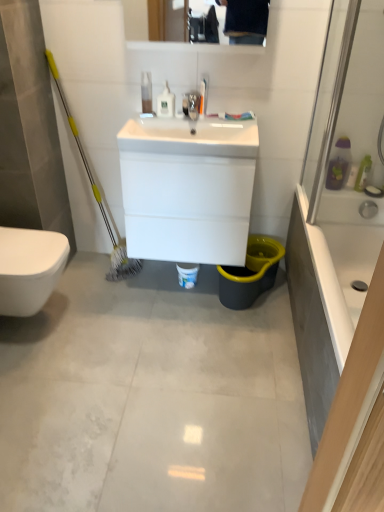
Based on the photo, measure the distance between point (x=164, y=89) and camera.

Point (x=164, y=89) is 2.01 meters from camera.

The height and width of the screenshot is (512, 384). What do you see at coordinates (191, 137) in the screenshot?
I see `white glossy sink at center, the 2th sink in the bottom-to-top sequence` at bounding box center [191, 137].

Locate an element on the screen. white glossy sink at center, which is the first sink from top to bottom is located at coordinates (191, 137).

Describe the element at coordinates (151, 397) in the screenshot. The height and width of the screenshot is (512, 384). I see `gray tile floor at center` at that location.

Find the location of `white glossy bidet at lower left`. white glossy bidet at lower left is located at coordinates (29, 268).

Image resolution: width=384 pixels, height=512 pixels. Describe the element at coordinates (363, 174) in the screenshot. I see `translucent plastic toothbrush at upper right, which is the 3th toiletry in top-to-bottom order` at that location.

The width and height of the screenshot is (384, 512). In order to click on white glossy sink at center, which is the first sink in bottom-to-top order in this screenshot , I will do `click(188, 189)`.

Is white glossy sink at center, which is the first sink in bottom-to-top order, situated inside translucent plastic bottle at upper center, positioned as the third toiletry in bottom-to-top order, or outside?

white glossy sink at center, which is the first sink in bottom-to-top order, is not enclosed by translucent plastic bottle at upper center, positioned as the third toiletry in bottom-to-top order.

Which sink is the 1st one when counting from the right side of the translucent plastic bottle at upper center, the 1th toiletry viewed from the top? Please provide its 2D coordinates.

[(188, 189)]

From the image's perspective, is white glossy sink at center, the 2th sink from the top, over translucent plastic bottle at upper center, which appears as the 1th toiletry when viewed from the left?

No.

From a real-world perspective, is white glossy sink at center, which is the first sink in bottom-to-top order, positioned under translucent plastic bottle at upper center, positioned as the third toiletry in bottom-to-top order, based on gravity?

Yes, from a real-world perspective, white glossy sink at center, which is the first sink in bottom-to-top order, is beneath translucent plastic bottle at upper center, positioned as the third toiletry in bottom-to-top order.

Considering the sizes of objects white glossy bidet at lower left and white glossy bottle at upper center, which is the 2th toiletry from top to bottom, in the image provided, who is wider, white glossy bidet at lower left or white glossy bottle at upper center, which is the 2th toiletry from top to bottom,?

Wider between the two is white glossy bidet at lower left.

Considering the relative sizes of white glossy bidet at lower left and white glossy bottle at upper center, the second toiletry positioned from the right, in the image provided, is white glossy bidet at lower left shorter than white glossy bottle at upper center, the second toiletry positioned from the right,?

Incorrect, the height of white glossy bidet at lower left does not fall short of that of white glossy bottle at upper center, the second toiletry positioned from the right.

This screenshot has width=384, height=512. Identify the location of bidet below the white glossy bottle at upper center, marked as the second toiletry in a bottom-to-top arrangement (from the image's perspective). (29, 268).

Is translucent plastic bottle at upper center, the 1th toiletry viewed from the top, smaller than translucent plastic toothbrush at upper right, which is the 3th toiletry in top-to-bottom order?

Yes, translucent plastic bottle at upper center, the 1th toiletry viewed from the top, is smaller than translucent plastic toothbrush at upper right, which is the 3th toiletry in top-to-bottom order.

Is translucent plastic bottle at upper center, the 1th toiletry viewed from the top, situated inside translucent plastic toothbrush at upper right, positioned as the third toiletry in left-to-right order, or outside?

translucent plastic bottle at upper center, the 1th toiletry viewed from the top, is spatially situated outside translucent plastic toothbrush at upper right, positioned as the third toiletry in left-to-right order.

Considering the relative sizes of translucent plastic bottle at upper center, the 3th toiletry positioned from the right, and translucent plastic toothbrush at upper right, the first toiletry when ordered from right to left, in the image provided, is translucent plastic bottle at upper center, the 3th toiletry positioned from the right, taller than translucent plastic toothbrush at upper right, the first toiletry when ordered from right to left,?

No.

Based on the photo, is white glossy bathtub at right in front of translucent plastic bottle at upper center, positioned as the third toiletry in bottom-to-top order?

Yes, white glossy bathtub at right is in front of translucent plastic bottle at upper center, positioned as the third toiletry in bottom-to-top order.

Is white glossy bathtub at right aimed at translucent plastic bottle at upper center, the 3th toiletry positioned from the right?

No, white glossy bathtub at right is not facing towards translucent plastic bottle at upper center, the 3th toiletry positioned from the right.

Does white glossy bathtub at right have a larger size compared to translucent plastic bottle at upper center, the 1th toiletry viewed from the top?

Yes, white glossy bathtub at right is bigger than translucent plastic bottle at upper center, the 1th toiletry viewed from the top.

Does white glossy bathtub at right have a lesser width compared to translucent plastic bottle at upper center, positioned as the third toiletry in bottom-to-top order?

In fact, white glossy bathtub at right might be wider than translucent plastic bottle at upper center, positioned as the third toiletry in bottom-to-top order.

Could you measure the distance between translucent plastic toothbrush at upper right, the first toiletry when ordered from right to left, and white glossy sink at center, which is the first sink in bottom-to-top order?

A distance of 33.69 inches exists between translucent plastic toothbrush at upper right, the first toiletry when ordered from right to left, and white glossy sink at center, which is the first sink in bottom-to-top order.

How many degrees apart are the facing directions of translucent plastic toothbrush at upper right, the first toiletry when ordered from bottom to top, and white glossy sink at center, which is the first sink in bottom-to-top order?

0.222 degrees separate the facing orientations of translucent plastic toothbrush at upper right, the first toiletry when ordered from bottom to top, and white glossy sink at center, which is the first sink in bottom-to-top order.

Considering the positions of objects translucent plastic toothbrush at upper right, which is the 3th toiletry in top-to-bottom order, and white glossy sink at center, the 2th sink from the top, in the image provided, who is behind, translucent plastic toothbrush at upper right, which is the 3th toiletry in top-to-bottom order, or white glossy sink at center, the 2th sink from the top,?

translucent plastic toothbrush at upper right, which is the 3th toiletry in top-to-bottom order, is more distant.

From the image's perspective, is translucent plastic toothbrush at upper right, positioned as the third toiletry in left-to-right order, on top of white glossy sink at center, the 2th sink from the top?

Yes.

Considering the relative sizes of translucent plastic toothbrush at upper right, the first toiletry when ordered from right to left, and translucent plastic bottle at upper center, which appears as the 1th toiletry when viewed from the left, in the image provided, is translucent plastic toothbrush at upper right, the first toiletry when ordered from right to left, bigger than translucent plastic bottle at upper center, which appears as the 1th toiletry when viewed from the left,?

Indeed, translucent plastic toothbrush at upper right, the first toiletry when ordered from right to left, has a larger size compared to translucent plastic bottle at upper center, which appears as the 1th toiletry when viewed from the left.

Is translucent plastic toothbrush at upper right, the first toiletry when ordered from right to left, surrounding translucent plastic bottle at upper center, positioned as the third toiletry in bottom-to-top order?

No, translucent plastic bottle at upper center, positioned as the third toiletry in bottom-to-top order, is not a part of translucent plastic toothbrush at upper right, the first toiletry when ordered from right to left.

Is the position of translucent plastic toothbrush at upper right, the first toiletry when ordered from right to left, less distant than that of translucent plastic bottle at upper center, the 3th toiletry positioned from the right?

No.

Which point is more forward, (x=361, y=178) or (x=141, y=75)?

The point (x=141, y=75) is more forward.

From their relative heights in the image, would you say translucent plastic bottle at upper center, the 3th toiletry positioned from the right, is taller or shorter than white glossy bidet at lower left?

translucent plastic bottle at upper center, the 3th toiletry positioned from the right, is shorter than white glossy bidet at lower left.

From the picture: Is translucent plastic bottle at upper center, positioned as the third toiletry in bottom-to-top order, located outside white glossy bidet at lower left?

That's correct, translucent plastic bottle at upper center, positioned as the third toiletry in bottom-to-top order, is outside of white glossy bidet at lower left.

Considering the positions of objects translucent plastic bottle at upper center, the 1th toiletry viewed from the top, and white glossy bidet at lower left in the image provided, who is in front, translucent plastic bottle at upper center, the 1th toiletry viewed from the top, or white glossy bidet at lower left?

Positioned in front is white glossy bidet at lower left.

Can you confirm if translucent plastic bottle at upper center, which appears as the 1th toiletry when viewed from the left, is thinner than white glossy bidet at lower left?

Yes.

Locate an element on the screen. The height and width of the screenshot is (512, 384). sink that is the 2nd object directly below the translucent plastic bottle at upper center, which appears as the 1th toiletry when viewed from the left (from a real-world perspective) is located at coordinates (188, 189).

The width and height of the screenshot is (384, 512). In order to click on bidet to the left of white glossy bottle at upper center, the 2th toiletry in the left-to-right sequence in this screenshot , I will do `click(29, 268)`.

When comparing their distances from white glossy sink at center, the 2th sink from the top, does gray tile floor at center or white glossy bathtub at right seem further?

gray tile floor at center.

Based on their spatial positions, is gray tile floor at center or white glossy sink at center, which is the first sink from top to bottom, closer to white glossy sink at center, the 2th sink from the top?

white glossy sink at center, which is the first sink from top to bottom, lies closer to white glossy sink at center, the 2th sink from the top, than the other object.

Estimate the real-world distances between objects in this image. Which object is closer to white glossy bottle at upper center, the second toiletry positioned from the right, gray tile floor at center or white glossy bidet at lower left?

The object closer to white glossy bottle at upper center, the second toiletry positioned from the right, is white glossy bidet at lower left.

Based on their spatial positions, is white glossy bathtub at right or white glossy bidet at lower left closer to gray tile floor at center?

Based on the image, white glossy bidet at lower left appears to be nearer to gray tile floor at center.

Which object lies further to the anchor point white glossy bidet at lower left, gray tile floor at center or white glossy sink at center, which is the first sink in bottom-to-top order?

white glossy sink at center, which is the first sink in bottom-to-top order, is positioned further to the anchor white glossy bidet at lower left.

Based on their spatial positions, is white glossy bathtub at right or gray tile floor at center closer to translucent plastic bottle at upper center, positioned as the third toiletry in bottom-to-top order?

white glossy bathtub at right lies closer to translucent plastic bottle at upper center, positioned as the third toiletry in bottom-to-top order, than the other object.

Considering their positions, is white glossy bathtub at right positioned closer to white glossy sink at center, which is the first sink in bottom-to-top order, than white glossy sink at center, the 2th sink in the bottom-to-top sequence?

white glossy sink at center, the 2th sink in the bottom-to-top sequence, lies closer to white glossy sink at center, which is the first sink in bottom-to-top order, than the other object.

From the image, which object appears to be nearer to translucent plastic toothbrush at upper right, which is the 3th toiletry in top-to-bottom order, gray tile floor at center or white glossy sink at center, the 2th sink from the top?

white glossy sink at center, the 2th sink from the top, is closer to translucent plastic toothbrush at upper right, which is the 3th toiletry in top-to-bottom order.

I want to click on sink that lies between white glossy bottle at upper center, the 2th toiletry in the left-to-right sequence, and white glossy sink at center, which is the first sink in bottom-to-top order, from top to bottom, so click(x=191, y=137).

The height and width of the screenshot is (512, 384). What are the coordinates of `sink between translucent plastic bottle at upper center, positioned as the third toiletry in bottom-to-top order, and white glossy sink at center, which is the first sink in bottom-to-top order, in the vertical direction` in the screenshot? It's located at (191, 137).

Identify the location of concrete between white glossy bidet at lower left and translucent plastic toothbrush at upper right, the first toiletry when ordered from bottom to top, from left to right. (151, 397).

Find the location of a particular element. This screenshot has height=512, width=384. concrete situated between white glossy bidet at lower left and white glossy bathtub at right from left to right is located at coordinates 151,397.